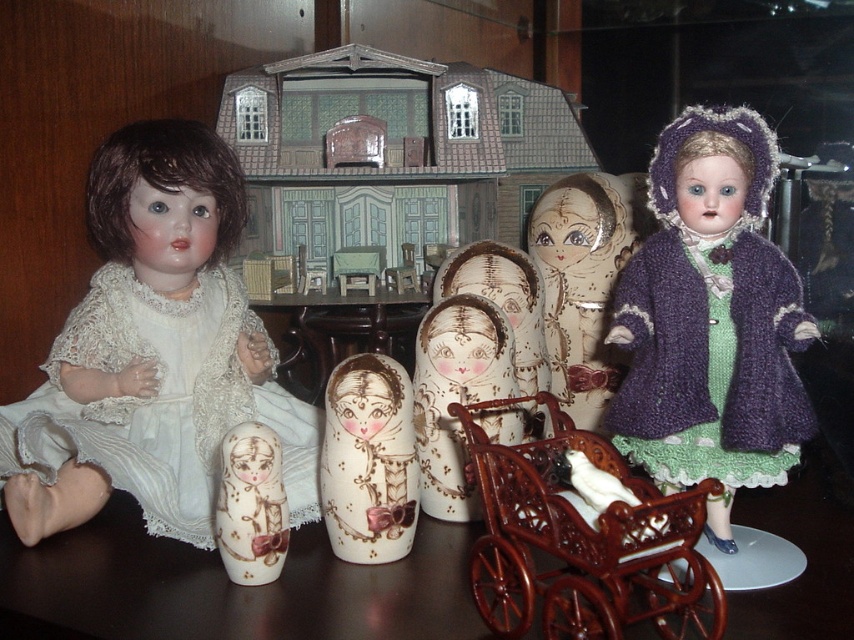
Between wooden doll at center and wooden table at center, which one is positioned higher?

wooden table at center is above.

Describe the element at coordinates (455, 396) in the screenshot. The height and width of the screenshot is (640, 854). I see `wooden doll at center` at that location.

Identify the location of wooden doll at center. The image size is (854, 640). (455, 396).

Which is more to the right, white lace dress at left or painted wood nesting dolls at center?

Positioned to the right is painted wood nesting dolls at center.

What do you see at coordinates (161, 403) in the screenshot? This screenshot has height=640, width=854. I see `white lace dress at left` at bounding box center [161, 403].

Image resolution: width=854 pixels, height=640 pixels. Find the location of `white lace dress at left`. white lace dress at left is located at coordinates (161, 403).

Is shiny brown wooden table at center bigger than white lace dress at left?

Yes, shiny brown wooden table at center is bigger than white lace dress at left.

Locate an element on the screen. shiny brown wooden table at center is located at coordinates (229, 588).